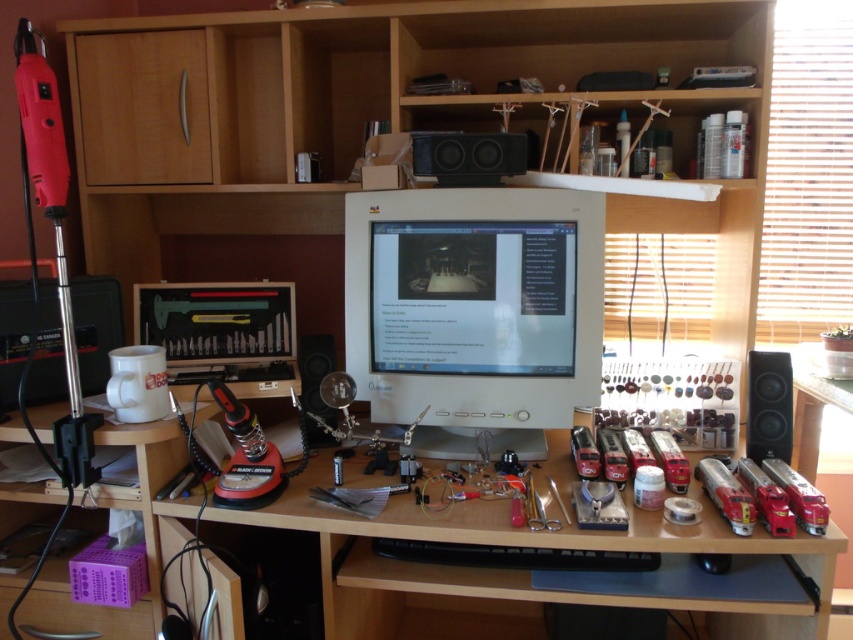
Which of these two, black matte speaker at upper center or black matte speaker at right, stands taller?

Standing taller between the two is black matte speaker at right.

Locate an element on the screen. This screenshot has width=853, height=640. black matte speaker at upper center is located at coordinates (468, 157).

Looking at this image, who is more forward, (764, 401) or (309, 372)?

Positioned in front is point (764, 401).

Between black matte speaker at right and matte black speaker at center, which one appears on the right side from the viewer's perspective?

black matte speaker at right

Is point (788, 364) positioned in front of point (305, 381)?

That is True.

Where is `black matte speaker at right`? black matte speaker at right is located at coordinates (769, 404).

Is white plastic monitor at center thinner than black matte speaker at upper center?

No.

Can you confirm if white plastic monitor at center is taller than black matte speaker at upper center?

Yes, white plastic monitor at center is taller than black matte speaker at upper center.

The width and height of the screenshot is (853, 640). Find the location of `white plastic monitor at center`. white plastic monitor at center is located at coordinates (517, 570).